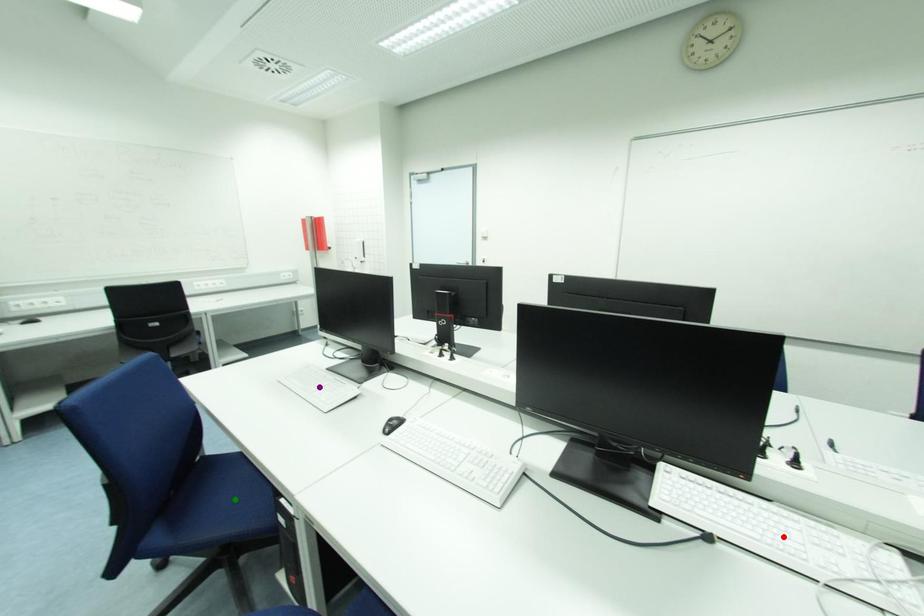
Order these from nearest to farthest:
1. green point
2. red point
3. purple point

red point → green point → purple point